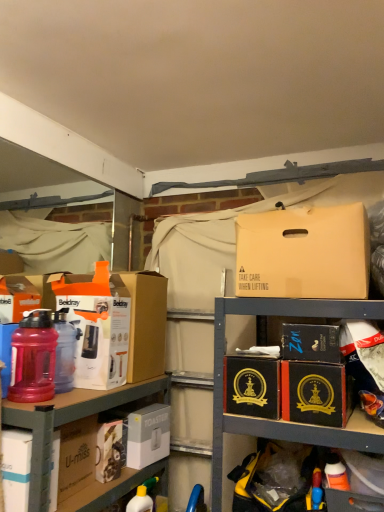
Question: Does point (51, 434) appear closer or farther from the camera than point (276, 411)?

Choices:
 (A) farther
 (B) closer

Answer: (B)

Question: Visually, is white cardboard toaster at lower left positioned to the left or to the right of black cardboard box at center, the second cardboard box in the right-to-left sequence?

Choices:
 (A) left
 (B) right

Answer: (A)

Question: Which object is the closest to the translucent plastic water bottle at left, positioned as the 2th bottle in back-to-front order?

Choices:
 (A) white cardboard box at left, the third cardboard box from the right
 (B) matte white box at left, acting as the 4th box starting from the right
 (C) yellow matte bottle at lower center
 (D) black cardboard box at center-right, arranged as the 6th box when viewed from the left
 (E) white matte toaster at lower left

Answer: (B)

Question: Estimate the real-world distances between objects in this image. Which object is farther from the matte plastic water bottle at left, which ranks as the 1th box in left-to-right order?

Choices:
 (A) white plastic toaster at lower left, arranged as the third box when viewed from the right
 (B) black cardboard box at center-right, positioned as the first box in right-to-left order
 (C) black cardboard box at center-right, positioned as the first cardboard box in right-to-left order
 (D) matte plastic water bottle at left, the 2th bottle when ordered from front to back
 (E) black cardboard box at center, which is the 2th cardboard box from left to right

Answer: (C)